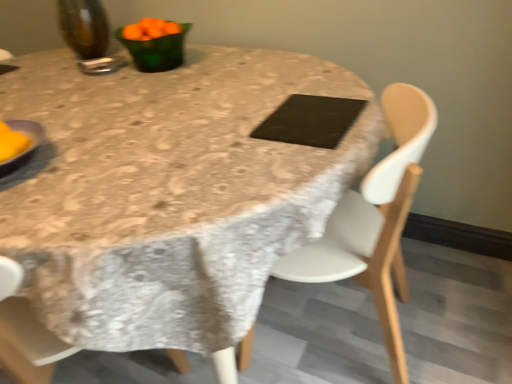
Locate an element on the screen. free space in front of black matte pad at center is located at coordinates (318, 152).